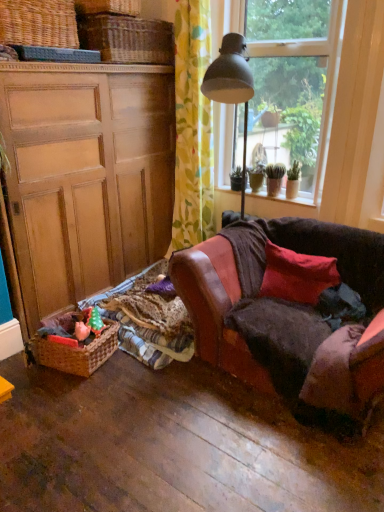
Question: Can you confirm if woven brown picnic basket at lower left, placed as the 2th picnic basket when sorted from top to bottom, is bigger than smooth concrete window sill at center?

Choices:
 (A) yes
 (B) no

Answer: (A)

Question: Can smooth concrete window sill at center be found inside woven brown picnic basket at lower left, which is counted as the 1th picnic basket, starting from the bottom?

Choices:
 (A) yes
 (B) no

Answer: (B)

Question: Is woven brown picnic basket at lower left, placed as the 2th picnic basket when sorted from top to bottom, facing towards smooth concrete window sill at center?

Choices:
 (A) no
 (B) yes

Answer: (A)

Question: Considering the relative sizes of woven brown picnic basket at lower left, which is counted as the 1th picnic basket, starting from the bottom, and smooth concrete window sill at center in the image provided, is woven brown picnic basket at lower left, which is counted as the 1th picnic basket, starting from the bottom, wider than smooth concrete window sill at center?

Choices:
 (A) no
 (B) yes

Answer: (B)

Question: From the image's perspective, is woven brown picnic basket at lower left, placed as the 2th picnic basket when sorted from top to bottom, below smooth concrete window sill at center?

Choices:
 (A) yes
 (B) no

Answer: (A)

Question: Is woven wicker basket at upper left, arranged as the second basket when viewed from the back, spatially inside woven brown picnic basket at upper left, which is counted as the 2th picnic basket, starting from the bottom, or outside of it?

Choices:
 (A) outside
 (B) inside

Answer: (A)

Question: In the image, is woven wicker basket at upper left, arranged as the second basket when viewed from the back, on the left side or the right side of woven brown picnic basket at upper left, the 1th picnic basket positioned from the top?

Choices:
 (A) left
 (B) right

Answer: (B)

Question: From a real-world perspective, is woven wicker basket at upper left, arranged as the second basket when viewed from the back, positioned above or below woven brown picnic basket at upper left, the 1th picnic basket positioned from the top?

Choices:
 (A) above
 (B) below

Answer: (A)

Question: Considering the positions of woven wicker basket at upper left, positioned as the first basket in front-to-back order, and woven brown picnic basket at upper left, the 1th picnic basket positioned from the top, in the image, is woven wicker basket at upper left, positioned as the first basket in front-to-back order, taller or shorter than woven brown picnic basket at upper left, the 1th picnic basket positioned from the top,?

Choices:
 (A) short
 (B) tall

Answer: (A)

Question: In terms of height, does clear glass window at upper right look taller or shorter compared to woven brown picnic basket at lower left, which is counted as the 1th picnic basket, starting from the bottom?

Choices:
 (A) tall
 (B) short

Answer: (A)

Question: In the image, is clear glass window at upper right positioned in front of or behind woven brown picnic basket at lower left, which is counted as the 1th picnic basket, starting from the bottom?

Choices:
 (A) front
 (B) behind

Answer: (B)

Question: Do you think clear glass window at upper right is within woven brown picnic basket at lower left, placed as the 2th picnic basket when sorted from top to bottom, or outside of it?

Choices:
 (A) inside
 (B) outside

Answer: (B)

Question: Is point (304, 89) positioned closer to the camera than point (112, 353)?

Choices:
 (A) closer
 (B) farther

Answer: (B)

Question: In terms of width, does woven wicker basket at upper left, arranged as the second basket when viewed from the back, look wider or thinner when compared to floral fabric curtain at upper center?

Choices:
 (A) wide
 (B) thin

Answer: (A)

Question: Do you think woven wicker basket at upper left, arranged as the second basket when viewed from the back, is within floral fabric curtain at upper center, or outside of it?

Choices:
 (A) inside
 (B) outside

Answer: (B)